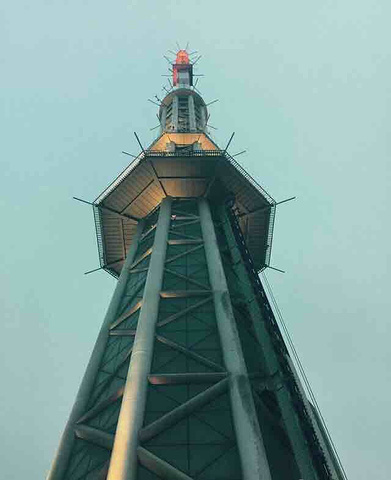
The height and width of the screenshot is (480, 391). I want to click on the right pipe, so click(151, 308).